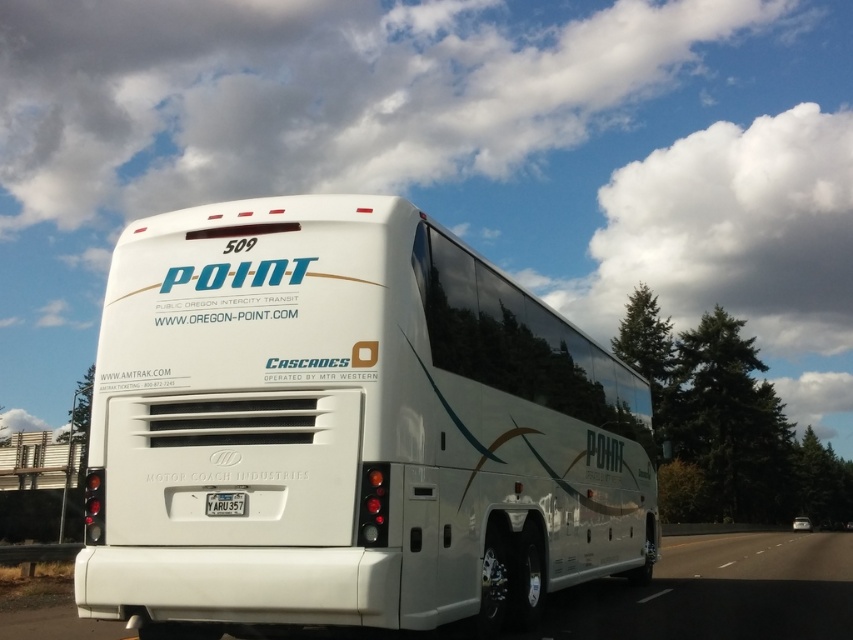
Question: Is white glossy bus at center below yellow matte license plate at center?

Choices:
 (A) yes
 (B) no

Answer: (A)

Question: Which point is closer to the camera?

Choices:
 (A) white glossy highway at lower right
 (B) white glossy bus at center

Answer: (B)

Question: Does white glossy highway at lower right have a greater width compared to yellow matte license plate at center?

Choices:
 (A) no
 (B) yes

Answer: (B)

Question: Which object appears closest to the camera in this image?

Choices:
 (A) white glossy highway at lower right
 (B) white glossy bus at center
 (C) yellow matte license plate at center

Answer: (B)

Question: Can you confirm if white glossy bus at center is smaller than white glossy highway at lower right?

Choices:
 (A) no
 (B) yes

Answer: (B)

Question: Among these points, which one is nearest to the camera?

Choices:
 (A) (218, 452)
 (B) (212, 493)
 (C) (654, 600)

Answer: (B)